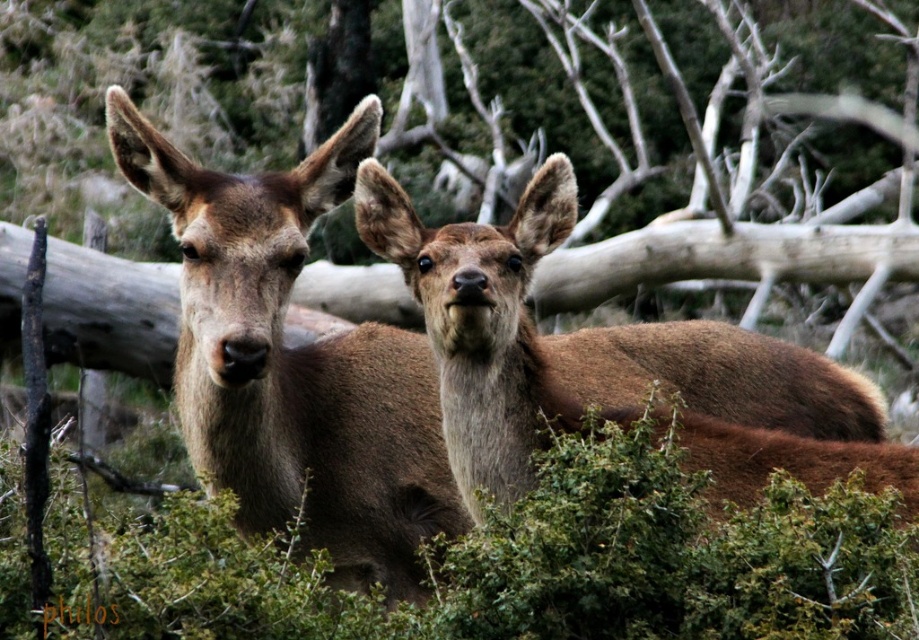
Question: Which point is closer to the camera?

Choices:
 (A) (762, 387)
 (B) (358, 371)

Answer: (B)

Question: Is brown fur deer at center below brown furry deer at center?

Choices:
 (A) yes
 (B) no

Answer: (B)

Question: Can you confirm if brown fur deer at center is positioned below brown furry deer at center?

Choices:
 (A) yes
 (B) no

Answer: (B)

Question: Does brown fur deer at center have a greater width compared to brown furry deer at center?

Choices:
 (A) no
 (B) yes

Answer: (A)

Question: Which of the following is the farthest from the observer?

Choices:
 (A) brown furry deer at center
 (B) brown fur deer at center

Answer: (A)

Question: Which point is farther from the camera taking this photo?

Choices:
 (A) (579, 340)
 (B) (367, 372)

Answer: (A)